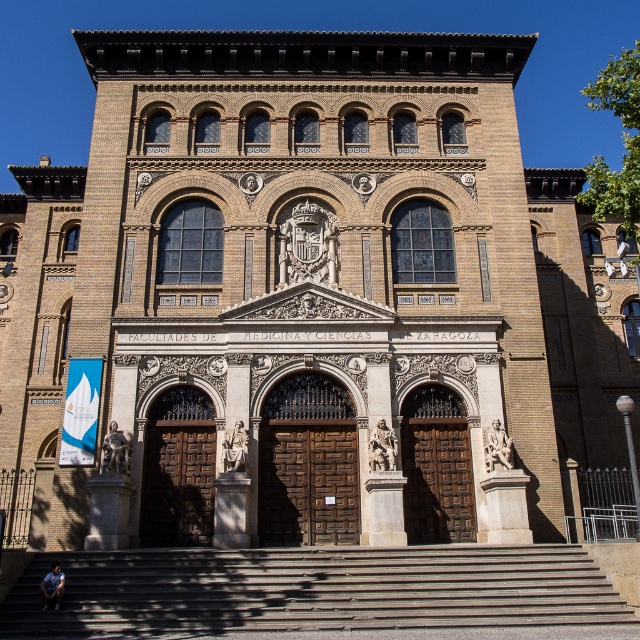
You are an art student analyzing the statues on the Facultades de Medicina y Ciencias de Zaragoza facade. You need to determine if the marble statue at right can be moved to the space currently occupied by the stone statue at center without altering the building structure. Based on their widths, is this feasible?

The marble statue at right might be wider than the stone statue at center, so it is uncertain if it can fit without structural changes.

You are a visitor arriving at the Facultades de Medicina y Ciencias de Zaragoza. You see the brown wooden stairs at center and the wooden door at center. Which object is located below the other?

The brown wooden stairs at center is positioned under the wooden door at center.